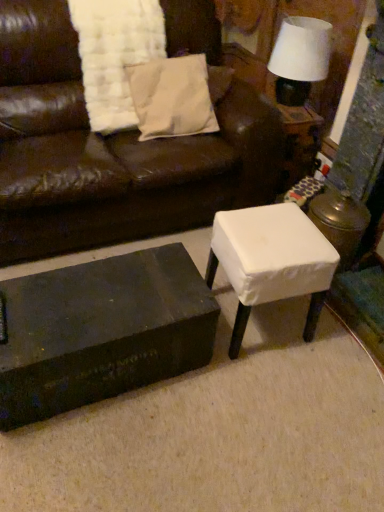
Identify the location of empty space that is ontop of white fabric stool at center (from a real-world perspective). (277, 236).